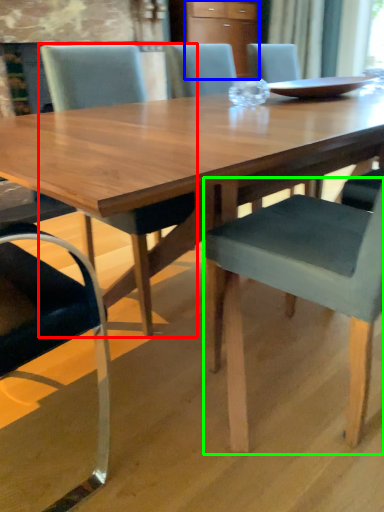
Question: Which is nearer to the chair (highlighted by a red box)? cabinetry (highlighted by a blue box) or chair (highlighted by a green box).

Choices:
 (A) cabinetry
 (B) chair

Answer: (B)